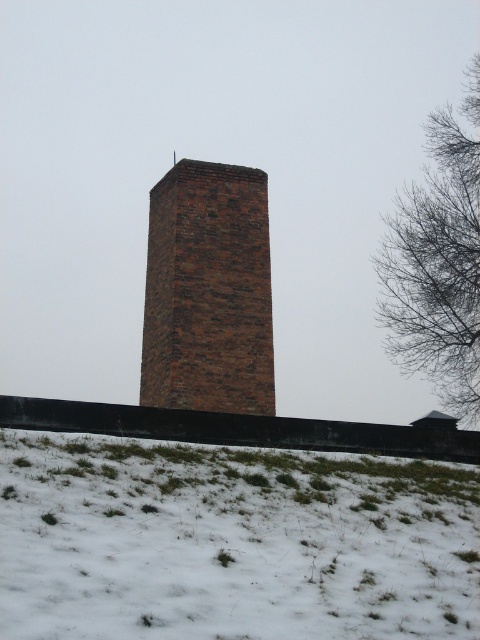
Is brick chimney at center thinner than bare branches at upper right?

Yes, brick chimney at center is thinner than bare branches at upper right.

Who is higher up, brick chimney at center or bare branches at upper right?

bare branches at upper right is above.

Image resolution: width=480 pixels, height=640 pixels. In order to click on brick chimney at center in this screenshot , I will do `click(207, 291)`.

Where is `brick chimney at center`? brick chimney at center is located at coordinates (207, 291).

Where is `white fluffy snow at lower center`? The width and height of the screenshot is (480, 640). white fluffy snow at lower center is located at coordinates (231, 541).

Can you confirm if white fluffy snow at lower center is shorter than bare branches at upper right?

Correct, white fluffy snow at lower center is not as tall as bare branches at upper right.

Which is behind, point (408, 541) or point (452, 131)?

The point (452, 131) is behind.

Identify the location of white fluffy snow at lower center. click(x=231, y=541).

Can you confirm if white fluffy snow at lower center is positioned to the right of brick chimney at center?

Yes, white fluffy snow at lower center is to the right of brick chimney at center.

Can you confirm if white fluffy snow at lower center is positioned above brick chimney at center?

Actually, white fluffy snow at lower center is below brick chimney at center.

I want to click on white fluffy snow at lower center, so click(231, 541).